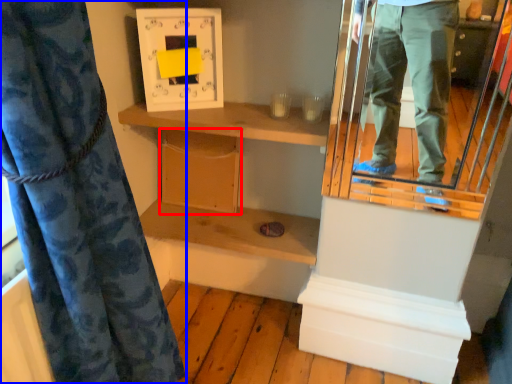
Question: Which point is closer to the camera, cabinet (highlighted by a red box) or curtain (highlighted by a blue box)?

Choices:
 (A) cabinet
 (B) curtain

Answer: (B)